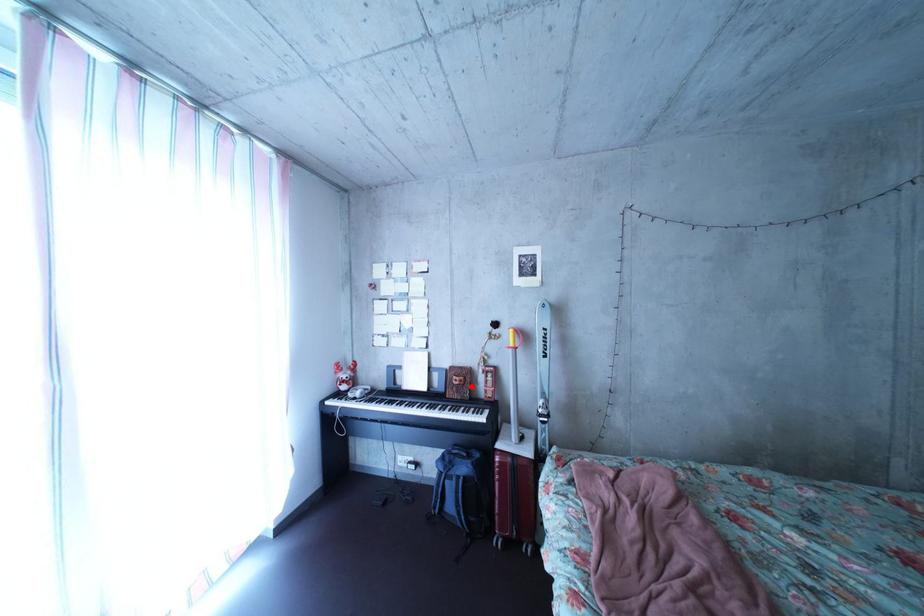
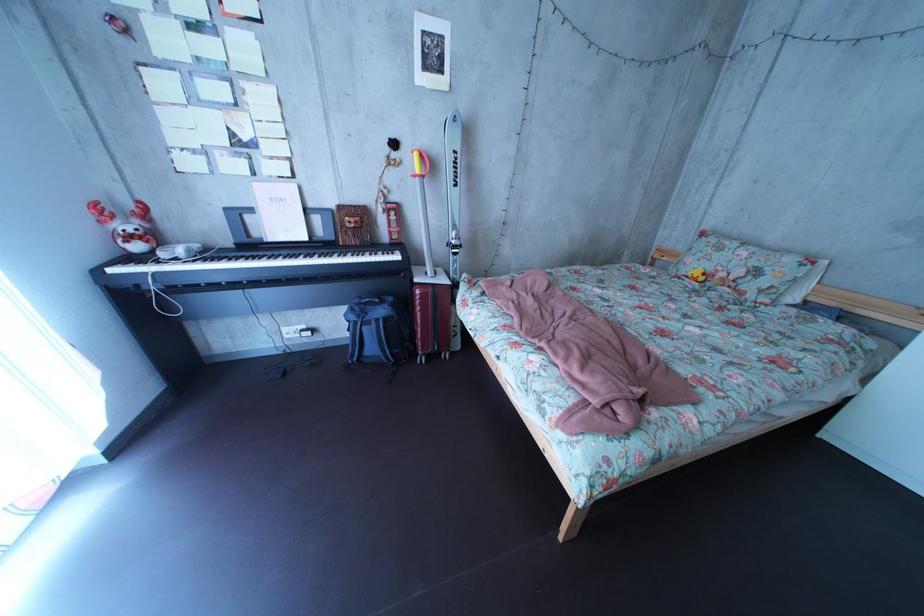
Question: I am providing you with two images of the same scene from different viewpoints. A red point is marked on the first image. At the location where the point appears in image 1, is it still visible in image 2?

Choices:
 (A) Yes
 (B) No

Answer: (A)